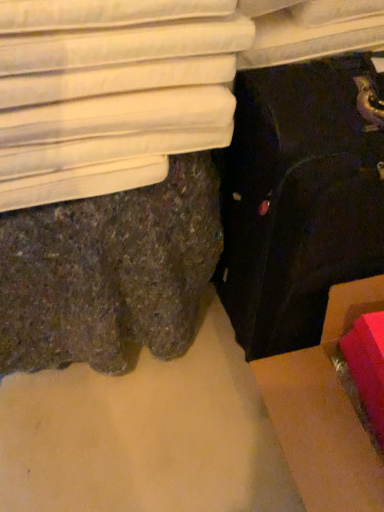
Question: In terms of width, does white fabric bed at upper left look wider or thinner when compared to cardboard box at lower right?

Choices:
 (A) thin
 (B) wide

Answer: (A)

Question: Considering the positions of point (137, 56) and point (299, 437), is point (137, 56) closer or farther from the camera than point (299, 437)?

Choices:
 (A) farther
 (B) closer

Answer: (B)

Question: Estimate the real-world distances between objects in this image. Which object is closer to the cardboard box at lower right?

Choices:
 (A) white fabric bed at upper left
 (B) black fabric suitcase at lower right

Answer: (B)

Question: Based on their relative distances, which object is nearer to the black fabric suitcase at lower right?

Choices:
 (A) cardboard box at lower right
 (B) white fabric bed at upper left

Answer: (A)